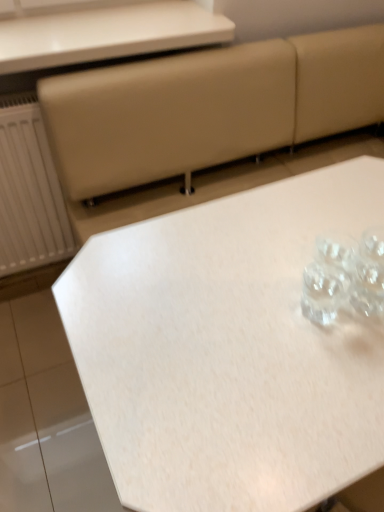
What is the approximate width of white matte table at center, the 1th table when ordered from bottom to top?

white matte table at center, the 1th table when ordered from bottom to top, is 23.29 inches in width.

Measure the distance between white matte table at center, the 1th table when ordered from bottom to top, and camera.

The distance of white matte table at center, the 1th table when ordered from bottom to top, from camera is 21.17 inches.

What do you see at coordinates (229, 349) in the screenshot? I see `white matte table at center, acting as the 2th table starting from the top` at bounding box center [229, 349].

Identify the location of white matte table at center, acting as the 2th table starting from the top. The width and height of the screenshot is (384, 512). (229, 349).

Image resolution: width=384 pixels, height=512 pixels. What are the coordinates of `white glossy table at upper center, placed as the second table when sorted from bottom to top` in the screenshot? It's located at (107, 34).

What is the approximate height of white glossy table at upper center, marked as the first table in a top-to-bottom arrangement?

1.97 inches.

In order to face white glossy table at upper center, marked as the first table in a top-to-bottom arrangement, should I rotate leftwards or rightwards?

A 10.165 degree turn to the left will do.

What do you see at coordinates (107, 34) in the screenshot?
I see `white glossy table at upper center, marked as the first table in a top-to-bottom arrangement` at bounding box center [107, 34].

At what (x,y) coordinates should I click in order to perform the action: click on white matte table at center, acting as the 2th table starting from the top. Please return your answer as a coordinate pair (x, y). Looking at the image, I should click on (229, 349).

Is white matte table at center, acting as the 2th table starting from the top, at the right side of white glossy table at upper center, marked as the first table in a top-to-bottom arrangement?

Yes, white matte table at center, acting as the 2th table starting from the top, is to the right of white glossy table at upper center, marked as the first table in a top-to-bottom arrangement.

Considering the positions of objects white matte table at center, acting as the 2th table starting from the top, and white glossy table at upper center, marked as the first table in a top-to-bottom arrangement, in the image provided, who is in front, white matte table at center, acting as the 2th table starting from the top, or white glossy table at upper center, marked as the first table in a top-to-bottom arrangement,?

white matte table at center, acting as the 2th table starting from the top.

Between point (272, 418) and point (78, 63), which one is positioned behind?

The point (78, 63) is farther from the camera.

From the image's perspective, between white matte table at center, the 1th table when ordered from bottom to top, and white glossy table at upper center, marked as the first table in a top-to-bottom arrangement, who is located below?

white matte table at center, the 1th table when ordered from bottom to top, from the image's perspective.

From a real-world perspective, between white matte table at center, the 1th table when ordered from bottom to top, and white glossy table at upper center, placed as the second table when sorted from bottom to top, who is vertically higher?

white glossy table at upper center, placed as the second table when sorted from bottom to top, is physically above.

Is white matte table at center, the 1th table when ordered from bottom to top, wider than white glossy table at upper center, placed as the second table when sorted from bottom to top?

Correct, the width of white matte table at center, the 1th table when ordered from bottom to top, exceeds that of white glossy table at upper center, placed as the second table when sorted from bottom to top.

Based on the photo, considering the sizes of objects white matte table at center, acting as the 2th table starting from the top, and white glossy table at upper center, marked as the first table in a top-to-bottom arrangement, in the image provided, who is taller, white matte table at center, acting as the 2th table starting from the top, or white glossy table at upper center, marked as the first table in a top-to-bottom arrangement,?

With more height is white matte table at center, acting as the 2th table starting from the top.

Does white matte table at center, the 1th table when ordered from bottom to top, have a smaller size compared to white glossy table at upper center, marked as the first table in a top-to-bottom arrangement?

Incorrect, white matte table at center, the 1th table when ordered from bottom to top, is not smaller in size than white glossy table at upper center, marked as the first table in a top-to-bottom arrangement.

Choose the correct answer: Is white matte table at center, acting as the 2th table starting from the top, inside white glossy table at upper center, placed as the second table when sorted from bottom to top, or outside it?

white matte table at center, acting as the 2th table starting from the top, is located beyond the bounds of white glossy table at upper center, placed as the second table when sorted from bottom to top.

Is white matte table at center, the 1th table when ordered from bottom to top, next to white glossy table at upper center, marked as the first table in a top-to-bottom arrangement?

No, white matte table at center, the 1th table when ordered from bottom to top, is not making contact with white glossy table at upper center, marked as the first table in a top-to-bottom arrangement.

Could you tell me if white matte table at center, the 1th table when ordered from bottom to top, is facing white glossy table at upper center, placed as the second table when sorted from bottom to top?

No, white matte table at center, the 1th table when ordered from bottom to top, does not turn towards white glossy table at upper center, placed as the second table when sorted from bottom to top.

Could you measure the distance between white matte table at center, the 1th table when ordered from bottom to top, and white glossy table at upper center, placed as the second table when sorted from bottom to top?

A distance of 29.55 inches exists between white matte table at center, the 1th table when ordered from bottom to top, and white glossy table at upper center, placed as the second table when sorted from bottom to top.

There is a white matte table at center, the 1th table when ordered from bottom to top. Identify the location of table above it (from a real-world perspective). (107, 34).

Which is more to the right, white glossy table at upper center, placed as the second table when sorted from bottom to top, or white matte table at center, the 1th table when ordered from bottom to top?

white matte table at center, the 1th table when ordered from bottom to top, is more to the right.

Which object is closer to the camera, white glossy table at upper center, marked as the first table in a top-to-bottom arrangement, or white matte table at center, acting as the 2th table starting from the top?

white matte table at center, acting as the 2th table starting from the top, is closer to the camera.

Which is closer, (0,73) or (302,426)?

Point (0,73) is farther from the camera than point (302,426).

From the image's perspective, is white glossy table at upper center, marked as the first table in a top-to-bottom arrangement, above or below white matte table at center, the 1th table when ordered from bottom to top?

Based on their image positions, white glossy table at upper center, marked as the first table in a top-to-bottom arrangement, is located above white matte table at center, the 1th table when ordered from bottom to top.

From a real-world perspective, is white glossy table at upper center, placed as the second table when sorted from bottom to top, over white matte table at center, acting as the 2th table starting from the top?

Yes.

Considering the sizes of objects white glossy table at upper center, marked as the first table in a top-to-bottom arrangement, and white matte table at center, the 1th table when ordered from bottom to top, in the image provided, who is wider, white glossy table at upper center, marked as the first table in a top-to-bottom arrangement, or white matte table at center, the 1th table when ordered from bottom to top,?

Wider between the two is white matte table at center, the 1th table when ordered from bottom to top.

Between white glossy table at upper center, placed as the second table when sorted from bottom to top, and white matte table at center, the 1th table when ordered from bottom to top, which one has less height?

With less height is white glossy table at upper center, placed as the second table when sorted from bottom to top.

In terms of size, does white glossy table at upper center, placed as the second table when sorted from bottom to top, appear bigger or smaller than white matte table at center, the 1th table when ordered from bottom to top?

In the image, white glossy table at upper center, placed as the second table when sorted from bottom to top, appears to be smaller than white matte table at center, the 1th table when ordered from bottom to top.

Can we say white glossy table at upper center, marked as the first table in a top-to-bottom arrangement, lies outside white matte table at center, acting as the 2th table starting from the top?

Indeed, white glossy table at upper center, marked as the first table in a top-to-bottom arrangement, is completely outside white matte table at center, acting as the 2th table starting from the top.

Can you see white glossy table at upper center, marked as the first table in a top-to-bottom arrangement, touching white matte table at center, acting as the 2th table starting from the top?

No, white glossy table at upper center, marked as the first table in a top-to-bottom arrangement, is not beside white matte table at center, acting as the 2th table starting from the top.

Is white glossy table at upper center, placed as the second table when sorted from bottom to top, facing away from white matte table at center, acting as the 2th table starting from the top?

No.

Could you measure the distance between white glossy table at upper center, marked as the first table in a top-to-bottom arrangement, and white matte table at center, acting as the 2th table starting from the top?

A distance of 29.55 inches exists between white glossy table at upper center, marked as the first table in a top-to-bottom arrangement, and white matte table at center, acting as the 2th table starting from the top.

Locate an element on the screen. Image resolution: width=384 pixels, height=512 pixels. table behind the white matte table at center, the 1th table when ordered from bottom to top is located at coordinates (107, 34).

This screenshot has height=512, width=384. I want to click on table in front of the white glossy table at upper center, marked as the first table in a top-to-bottom arrangement, so click(x=229, y=349).

The height and width of the screenshot is (512, 384). Find the location of `table lying below the white glossy table at upper center, marked as the first table in a top-to-bottom arrangement (from the image's perspective)`. table lying below the white glossy table at upper center, marked as the first table in a top-to-bottom arrangement (from the image's perspective) is located at coordinates (229, 349).